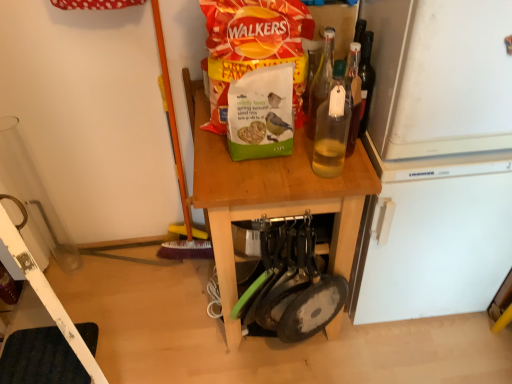
This screenshot has height=384, width=512. What are the coordinates of `vacant area on the back side of white plastic ladder at lower left` in the screenshot? It's located at tap(106, 286).